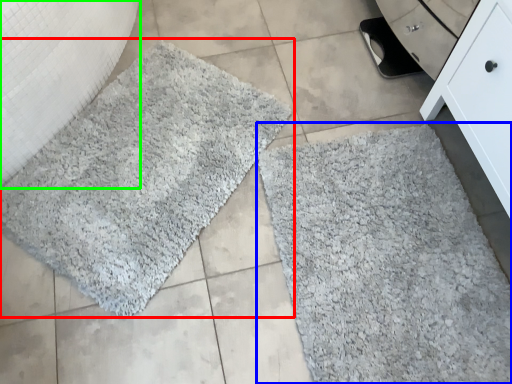
Question: Which object is positioned closest to bath mat (highlighted by a red box)? Select from bath mat (highlighted by a blue box) and granite (highlighted by a green box).

Choices:
 (A) bath mat
 (B) granite

Answer: (B)